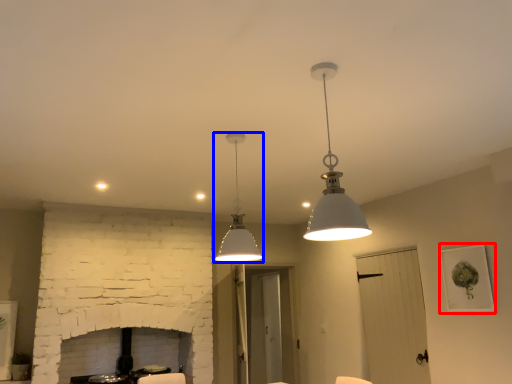
Question: Among these objects, which one is farthest to the camera, picture frame (highlighted by a red box) or lamp (highlighted by a blue box)?

Choices:
 (A) picture frame
 (B) lamp

Answer: (A)